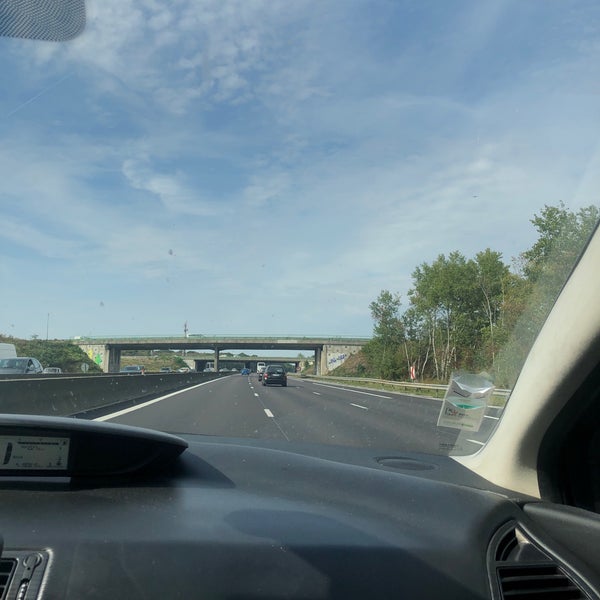
Locate an element on the screen. vent is located at coordinates (530, 582), (510, 547), (5, 570).